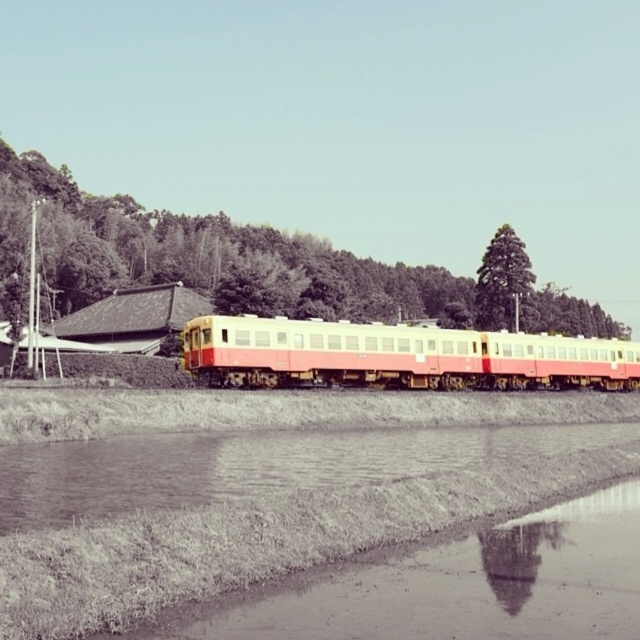
You are a photographer trying to capture the matte pink and cream passenger train at center and the green leafy tree at center in the same frame. Based on their sizes, which object would appear more prominent in the photo?

The green leafy tree at center is larger in size than the matte pink and cream passenger train at center, so it would appear more prominent in the photo.

You are standing at the edge of the waterway and see the matte pink and cream passenger train at center and the green leafy tree at upper center. Which object is positioned to the left of the other?

The matte pink and cream passenger train at center is to the left of green leafy tree at upper center.

You are standing at the edge of the waterway in the rural scene. You see two points marked in the image. Which point is closer to you, point (124, 275) or point (512, 316)?

Point (124, 275) is closer to you because it is further to the viewer than point (512, 316).